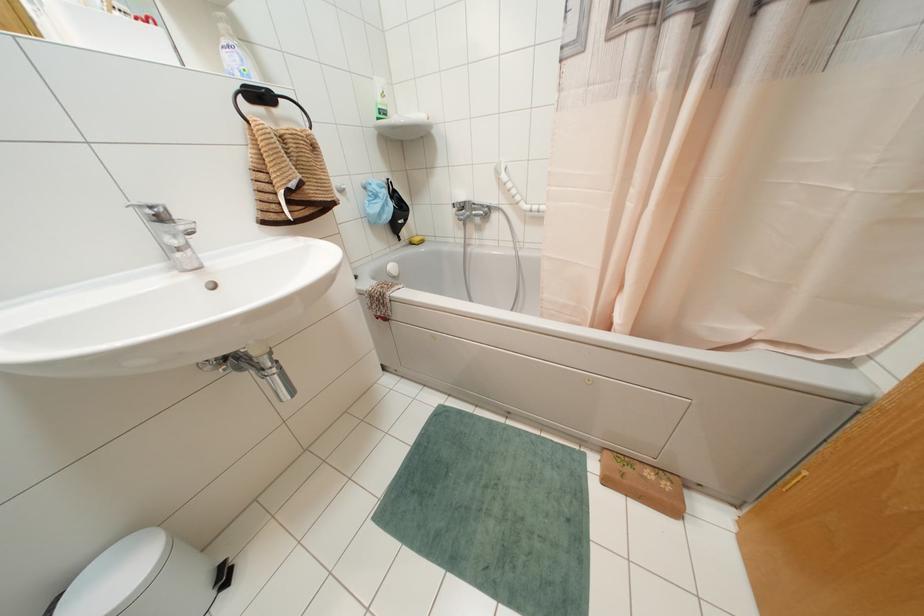
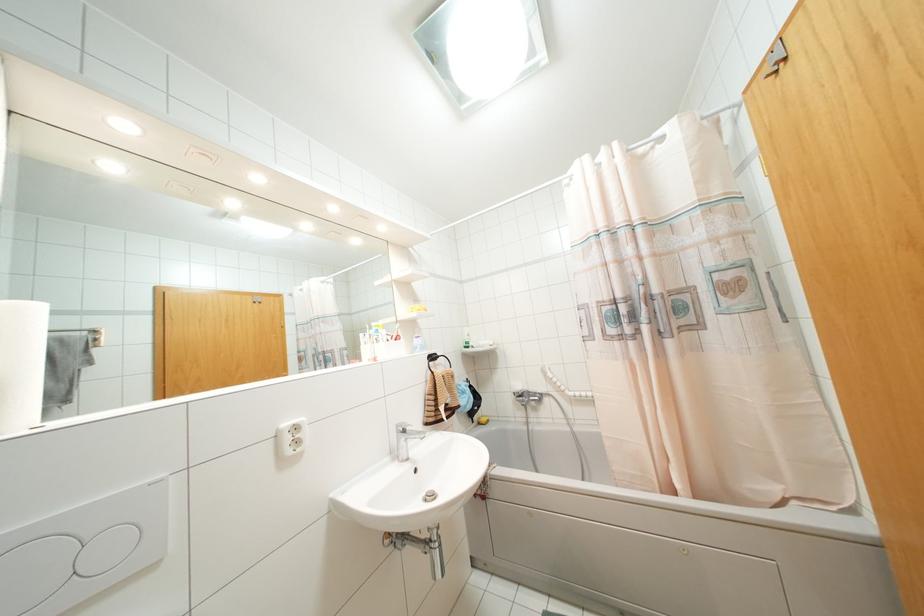
Find the pixel in the second image that matches (x=382, y=94) in the first image.

(468, 334)